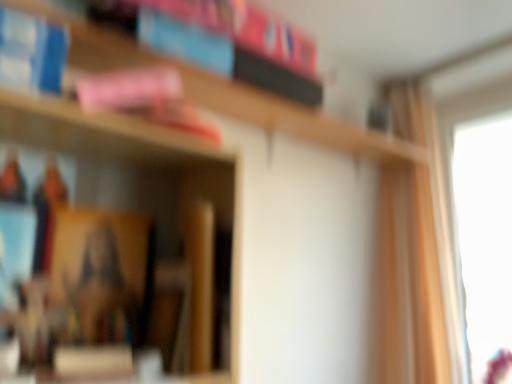
Question: Do you think wooden bookshelf at upper center is within light beige fabric curtain at right, or outside of it?

Choices:
 (A) outside
 (B) inside

Answer: (A)

Question: Looking at the image, does wooden bookshelf at upper center seem bigger or smaller compared to light beige fabric curtain at right?

Choices:
 (A) small
 (B) big

Answer: (A)

Question: In terms of width, does wooden bookshelf at upper center look wider or thinner when compared to light beige fabric curtain at right?

Choices:
 (A) thin
 (B) wide

Answer: (B)

Question: Looking at the image, does light beige fabric curtain at right seem bigger or smaller compared to wooden bookshelf at upper center?

Choices:
 (A) small
 (B) big

Answer: (B)

Question: Is point (406, 107) positioned closer to the camera than point (382, 144)?

Choices:
 (A) farther
 (B) closer

Answer: (A)

Question: Considering the positions of light beige fabric curtain at right and wooden bookshelf at upper center in the image, is light beige fabric curtain at right taller or shorter than wooden bookshelf at upper center?

Choices:
 (A) tall
 (B) short

Answer: (A)

Question: From a real-world perspective, relative to wooden bookshelf at upper center, is light beige fabric curtain at right vertically above or below?

Choices:
 (A) below
 (B) above

Answer: (A)